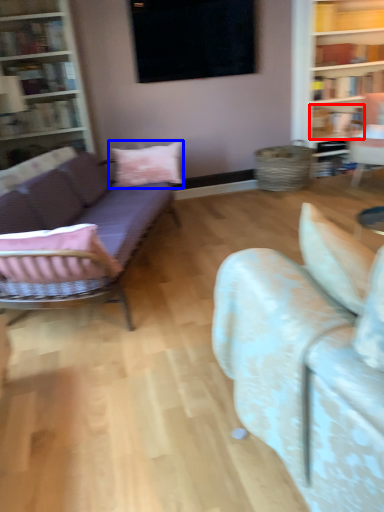
Question: Which object is closer to the camera taking this photo, book (highlighted by a red box) or pillow (highlighted by a blue box)?

Choices:
 (A) book
 (B) pillow

Answer: (B)